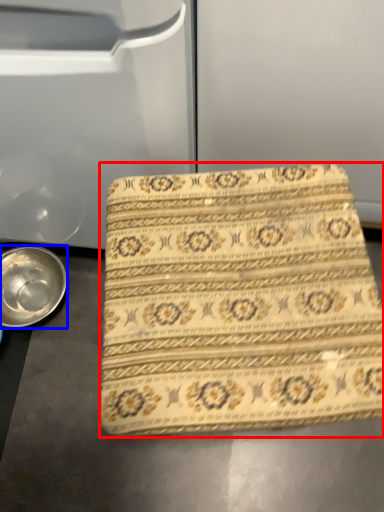
Question: Among these objects, which one is farthest to the camera, beach towel (highlighted by a red box) or bowl (highlighted by a blue box)?

Choices:
 (A) beach towel
 (B) bowl

Answer: (B)